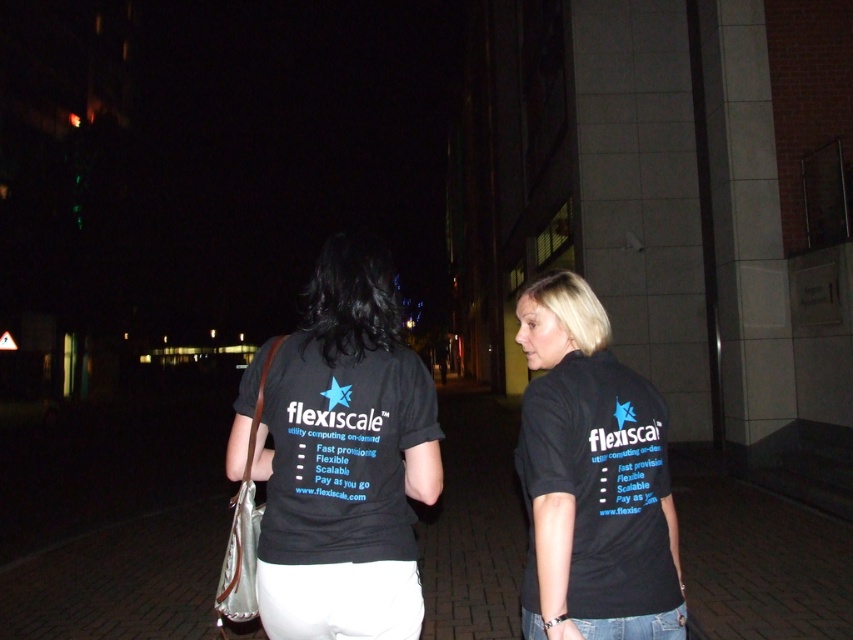
Which is more to the right, black fabric shirt at center or black matte t-shirt at center?

black matte t-shirt at center

Can you confirm if black fabric shirt at center is thinner than black matte t-shirt at center?

No, black fabric shirt at center is not thinner than black matte t-shirt at center.

Is point (364, 428) positioned behind point (590, 576)?

Yes, it is.

Locate an element on the screen. Image resolution: width=853 pixels, height=640 pixels. black fabric shirt at center is located at coordinates (340, 458).

Is black fabric t-shirt at center thinner than black matte t-shirt at center?

In fact, black fabric t-shirt at center might be wider than black matte t-shirt at center.

Does black fabric t-shirt at center come in front of black matte t-shirt at center?

No, black fabric t-shirt at center is behind black matte t-shirt at center.

Which is behind, point (570, 621) or point (544, 557)?

Point (570, 621)

Identify the location of black fabric t-shirt at center. The height and width of the screenshot is (640, 853). [340, 454].

Is point (303, 440) positioned in front of point (291, 344)?

Yes, point (303, 440) is closer to viewer.

Does black fabric t-shirt at center appear on the right side of black fabric shirt at center?

Indeed, black fabric t-shirt at center is positioned on the right side of black fabric shirt at center.

Between point (544, 324) and point (315, 552), which one is positioned behind?

Point (544, 324)

In order to click on black fabric t-shirt at center in this screenshot , I will do `click(340, 454)`.